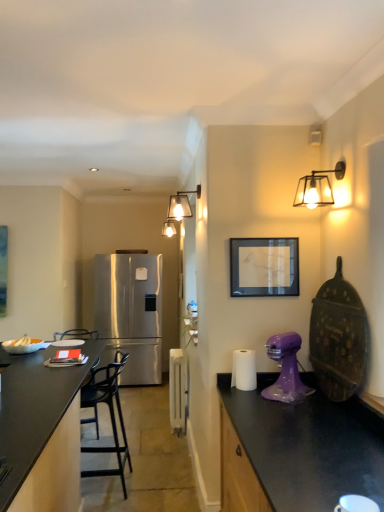
Question: Do you think metallic glass sconce at upper right, which is the first light fixture in front-to-back order, is within satin stainless steel refrigerator at center, or outside of it?

Choices:
 (A) outside
 (B) inside

Answer: (A)

Question: Is metallic glass sconce at upper right, which ranks as the 2th light fixture in left-to-right order, taller or shorter than satin stainless steel refrigerator at center?

Choices:
 (A) tall
 (B) short

Answer: (B)

Question: Based on their relative distances, which object is nearer to the white glossy radiator at center, the second appliance in the right-to-left sequence?

Choices:
 (A) satin stainless steel refrigerator at center
 (B) metallic glass sconce at upper right, which ranks as the second light fixture in back-to-front order
 (C) black matte chair at center
 (D) wooden carved shield at right, which appears as the first appliance when viewed from the top
 (E) white glossy coffee cup at lower right

Answer: (C)

Question: Estimate the real-world distances between objects in this image. Which object is farther from the black matte chair at center?

Choices:
 (A) wooden carved shield at right, which is counted as the first appliance, starting from the right
 (B) matte glass sconce at upper center, acting as the 2th light fixture starting from the front
 (C) white glossy radiator at center, which is counted as the 1th appliance, starting from the back
 (D) satin stainless steel refrigerator at center
 (E) matte black picture frame at upper center

Answer: (D)